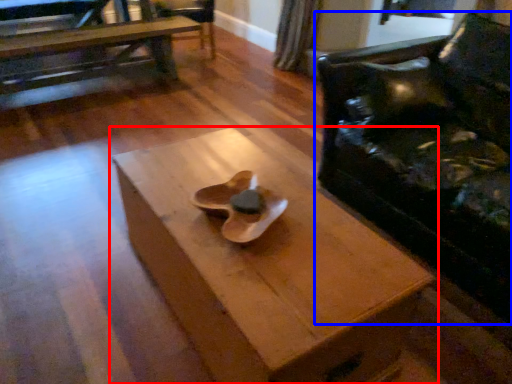
Question: Which of the following is the closest to the observer, table (highlighted by a red box) or chair (highlighted by a blue box)?

Choices:
 (A) table
 (B) chair

Answer: (A)